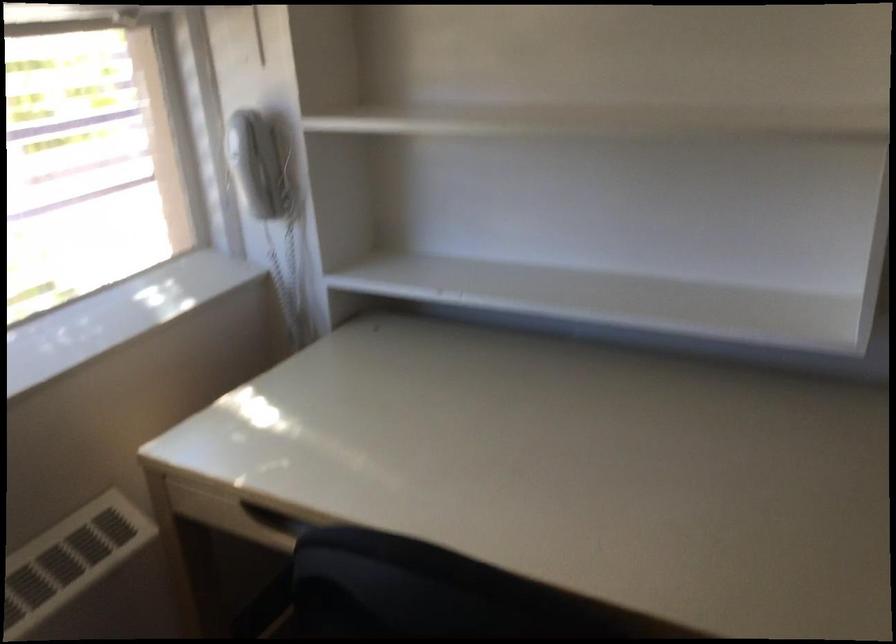
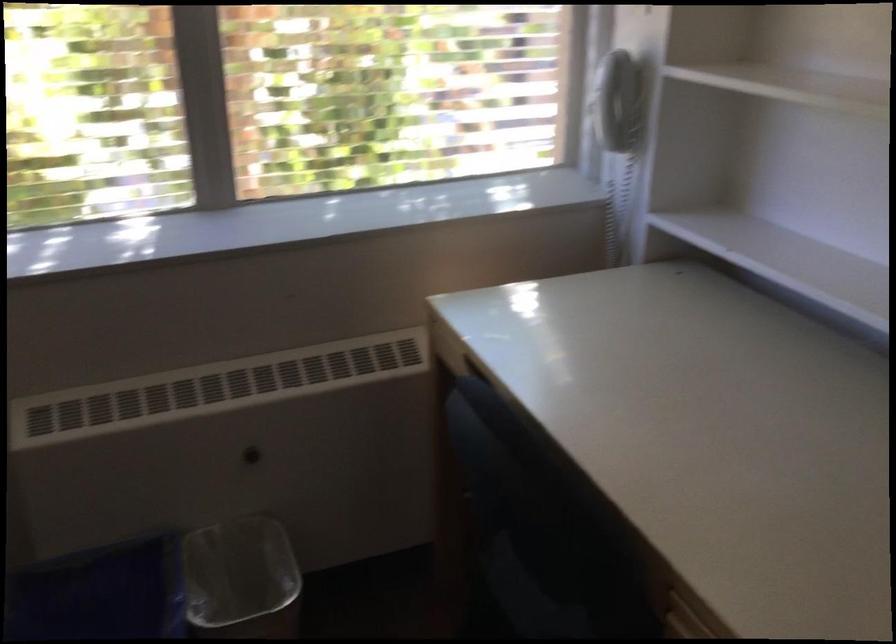
Question: Based on the continuous images, in which direction is the camera rotating? Reply with the corresponding letter.

Choices:
 (A) Left
 (B) Right
 (C) Up
 (D) Down

Answer: (A)